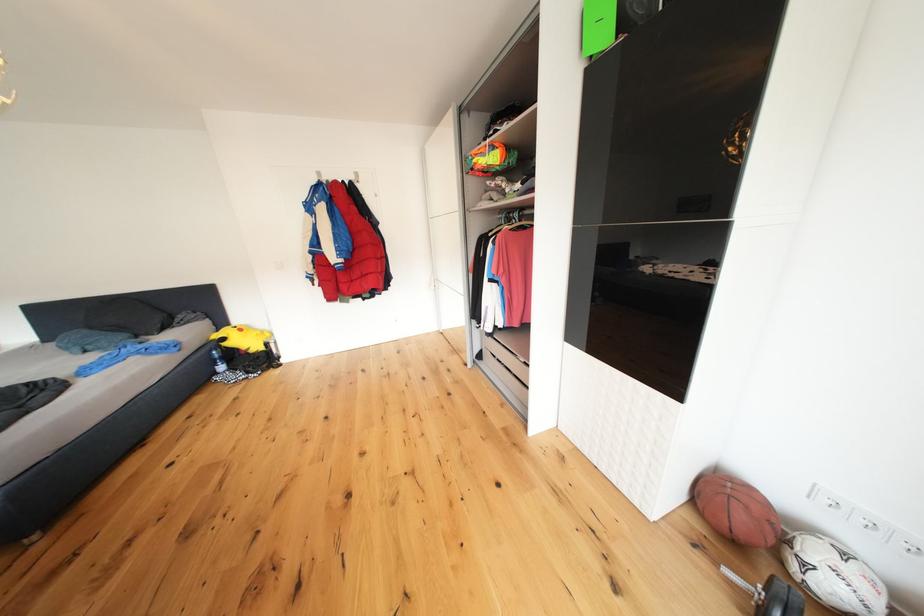
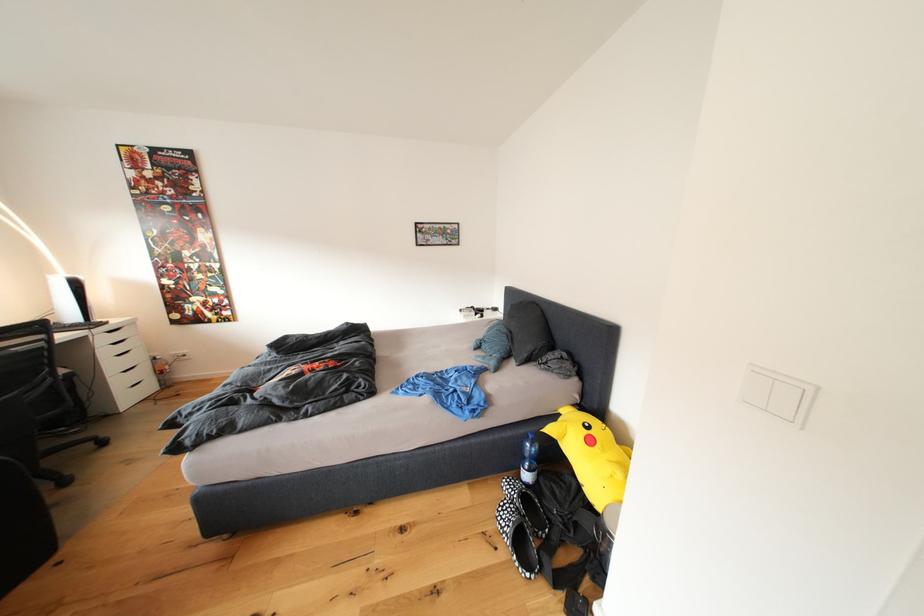
The point at (221, 360) is marked in the first image. Where is the corresponding point in the second image?

(531, 451)